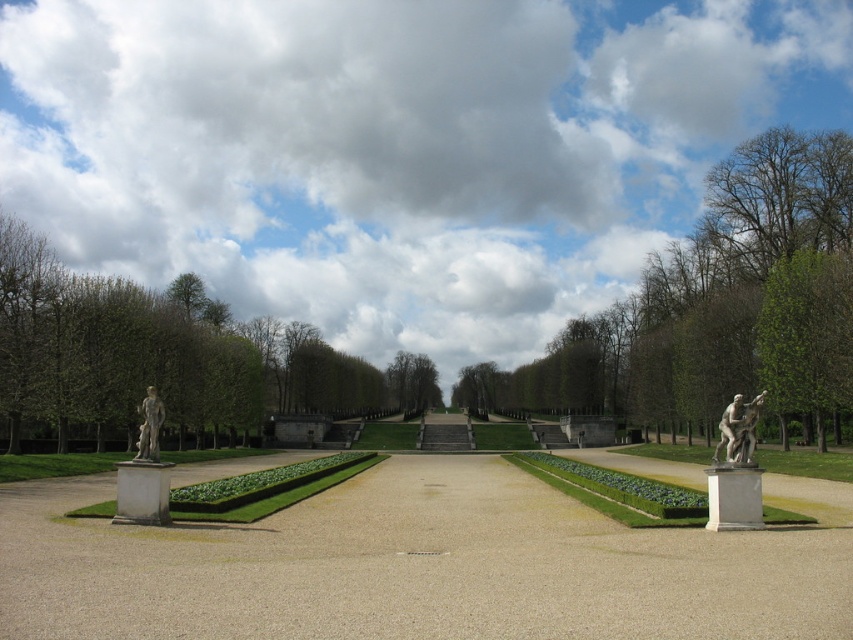
Question: Can you confirm if smooth concrete path at center is positioned below green leafy tree at right?

Choices:
 (A) no
 (B) yes

Answer: (B)

Question: Among these points, which one is farthest from the camera?

Choices:
 (A) (740, 454)
 (B) (775, 356)

Answer: (B)

Question: Which point is farther from the camera taking this photo?

Choices:
 (A) (776, 337)
 (B) (131, 323)

Answer: (B)

Question: Which of these objects is positioned closest to the green leafy tree at right?

Choices:
 (A) green leafy tree at center
 (B) green leafy tree at left
 (C) silver metallic statue at right

Answer: (A)

Question: Is green leafy tree at center smaller than matte gray statue at left?

Choices:
 (A) no
 (B) yes

Answer: (A)

Question: Can you confirm if smooth concrete path at center is positioned to the right of silver metallic statue at right?

Choices:
 (A) yes
 (B) no

Answer: (B)